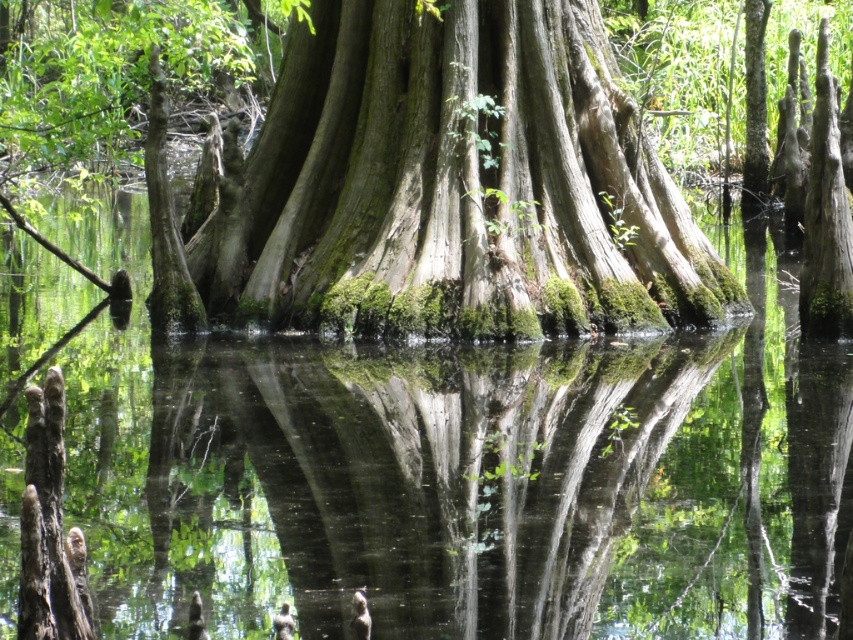
Question: Which point is closer to the camera taking this photo?

Choices:
 (A) tap(387, 384)
 (B) tap(231, 449)

Answer: (B)

Question: Considering the relative positions of green mossy water at center and green mossy bark at center in the image provided, where is green mossy water at center located with respect to green mossy bark at center?

Choices:
 (A) left
 (B) right

Answer: (A)

Question: Which of these objects is positioned closest to the green mossy tree roots at center?

Choices:
 (A) green mossy bark at center
 (B) green mossy water at center

Answer: (B)

Question: Which object is positioned farthest from the green mossy bark at center?

Choices:
 (A) green mossy water at center
 (B) green mossy tree roots at center

Answer: (B)

Question: Can you confirm if green mossy water at center is positioned to the right of green mossy tree roots at center?

Choices:
 (A) yes
 (B) no

Answer: (B)

Question: Does green mossy tree roots at center lie in front of green mossy bark at center?

Choices:
 (A) yes
 (B) no

Answer: (A)